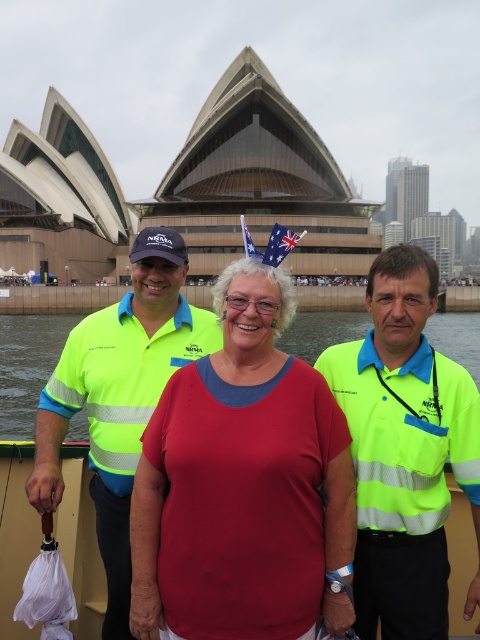
Question: Is red matte shirt at center closer to the viewer compared to neon yellow reflective shirt at center?

Choices:
 (A) yes
 (B) no

Answer: (A)

Question: Among these points, which one is farthest from the camera?

Choices:
 (A) (141, 314)
 (B) (156, 572)
 (C) (410, 500)

Answer: (A)

Question: Which point is closer to the camera?

Choices:
 (A) (345, 381)
 (B) (131, 428)

Answer: (B)

Question: Estimate the real-world distances between objects in this image. Which object is closer to the matte yellow uniform at center?

Choices:
 (A) blue fabric flag at center
 (B) red matte shirt at center
 (C) neon yellow reflective shirt at center

Answer: (C)

Question: Where is matte yellow uniform at center located in relation to neon yellow reflective safety vest at center in the image?

Choices:
 (A) above
 (B) below

Answer: (B)

Question: Is red matte shirt at center to the right of red fabric flag at center from the viewer's perspective?

Choices:
 (A) no
 (B) yes

Answer: (A)